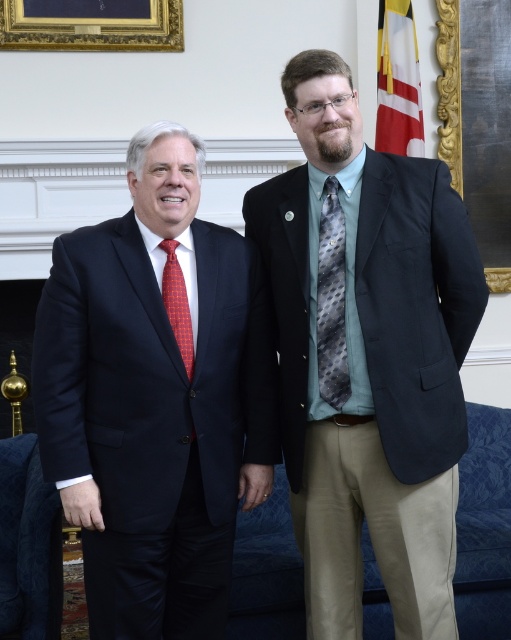
Is navy blue suit at left to the left of white fabric flag at upper right from the viewer's perspective?

Indeed, navy blue suit at left is positioned on the left side of white fabric flag at upper right.

Which of these two, navy blue suit at left or white fabric flag at upper right, stands shorter?

white fabric flag at upper right is shorter.

Identify the location of navy blue suit at left. (148, 401).

How distant is matte black blazer at center from red dotted tie at left?

19.89 inches

At what (x,y) coordinates should I click in order to perform the action: click on matte black blazer at center. Please return your answer as a coordinate pair (x, y). Image resolution: width=511 pixels, height=640 pixels. Looking at the image, I should click on (367, 355).

Is point (290, 124) less distant than point (183, 355)?

No, it is behind (183, 355).

Locate an element on the screen. The height and width of the screenshot is (640, 511). matte black blazer at center is located at coordinates (367, 355).

Consider the image. Who is lower down, matte black blazer at center or goldwooden frame at upper center?

matte black blazer at center

Is matte black blazer at center below goldwooden frame at upper center?

Yes, matte black blazer at center is below goldwooden frame at upper center.

Is point (406, 236) in front of point (29, 45)?

Yes, point (406, 236) is in front of point (29, 45).

The width and height of the screenshot is (511, 640). In order to click on matte black blazer at center in this screenshot , I will do `click(367, 355)`.